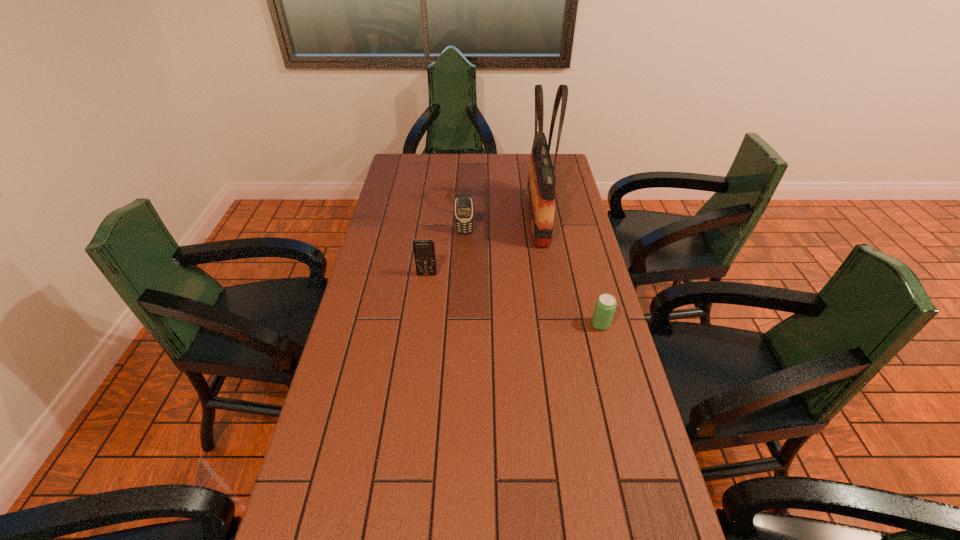
The width and height of the screenshot is (960, 540). Find the location of `vacant space that satisfies the following two spatial constraints: 1. on the front-facing side of the tallest object; 2. on the back side of the soda`. vacant space that satisfies the following two spatial constraints: 1. on the front-facing side of the tallest object; 2. on the back side of the soda is located at coordinates (555, 325).